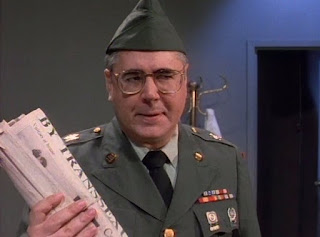
Find the location of `doorway`. doorway is located at coordinates (296, 135).